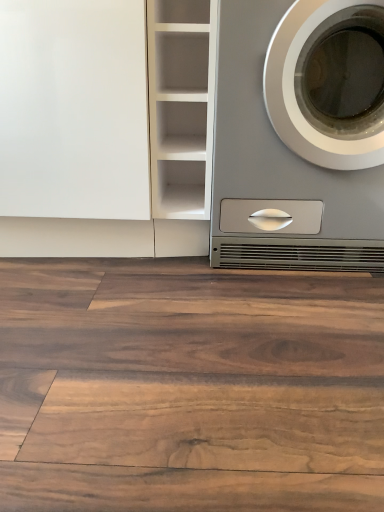
Question: Should I look upward or downward to see brown wood flooring at center?

Choices:
 (A) up
 (B) down

Answer: (B)

Question: Is white matte cabinet at center positioned behind satin silver washing machine at right?

Choices:
 (A) no
 (B) yes

Answer: (B)

Question: Considering the relative positions of white matte cabinet at center and satin silver washing machine at right in the image provided, is white matte cabinet at center to the left of satin silver washing machine at right from the viewer's perspective?

Choices:
 (A) no
 (B) yes

Answer: (B)

Question: From a real-world perspective, is white matte cabinet at center under satin silver washing machine at right?

Choices:
 (A) yes
 (B) no

Answer: (B)

Question: Is the surface of white matte cabinet at center in direct contact with satin silver washing machine at right?

Choices:
 (A) no
 (B) yes

Answer: (A)

Question: From a real-world perspective, does white matte cabinet at center stand above satin silver washing machine at right?

Choices:
 (A) yes
 (B) no

Answer: (A)

Question: Is white matte cabinet at center not inside satin silver washing machine at right?

Choices:
 (A) yes
 (B) no

Answer: (A)

Question: Is the depth of satin silver washing machine at right less than that of white matte cabinet at center?

Choices:
 (A) no
 (B) yes

Answer: (B)

Question: Is satin silver washing machine at right wider than white matte cabinet at center?

Choices:
 (A) yes
 (B) no

Answer: (B)

Question: Considering the relative sizes of satin silver washing machine at right and white matte cabinet at center in the image provided, is satin silver washing machine at right taller than white matte cabinet at center?

Choices:
 (A) yes
 (B) no

Answer: (A)

Question: Would you consider satin silver washing machine at right to be distant from white matte cabinet at center?

Choices:
 (A) yes
 (B) no

Answer: (B)

Question: Is satin silver washing machine at right in contact with white matte cabinet at center?

Choices:
 (A) yes
 (B) no

Answer: (B)

Question: Is satin silver washing machine at right completely or partially outside of white matte cabinet at center?

Choices:
 (A) no
 (B) yes

Answer: (B)

Question: Is white glossy cabinet at upper left located outside white matte cabinet at center?

Choices:
 (A) yes
 (B) no

Answer: (A)